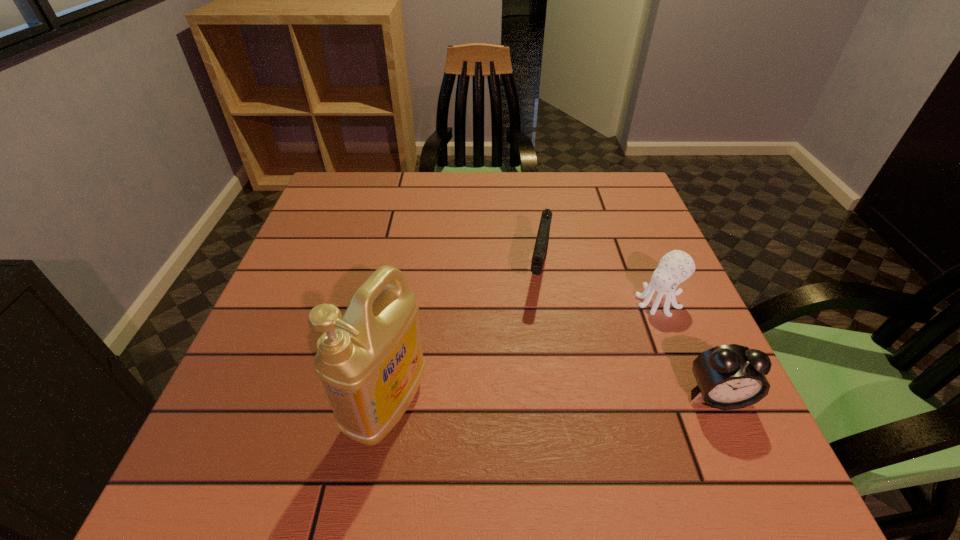
Locate an element on the screen. This screenshot has width=960, height=540. vacant area at the right edge of the desktop is located at coordinates (664, 317).

Where is `vacant space at the near left corner of the desktop`? Image resolution: width=960 pixels, height=540 pixels. vacant space at the near left corner of the desktop is located at coordinates (243, 426).

Identify the location of vacant space at the far right corner of the desktop. The width and height of the screenshot is (960, 540). (621, 201).

Image resolution: width=960 pixels, height=540 pixels. What are the coordinates of `vacant space at the near right corner of the desktop` in the screenshot? It's located at (674, 425).

This screenshot has width=960, height=540. In order to click on vacant space in between the leftmost object and the second object from left to right in this screenshot , I will do `click(463, 339)`.

This screenshot has width=960, height=540. In order to click on vacant area that lies between the pistol and the alarm clock in this screenshot , I will do `click(628, 334)`.

Find the location of a particular element. vacant space in between the detergent and the alarm clock is located at coordinates click(x=552, y=401).

The image size is (960, 540). Identify the location of vacant area that lies between the octopus and the alarm clock. (688, 349).

I want to click on unoccupied position between the detergent and the pistol, so click(x=463, y=339).

Identify the location of free space between the alarm clock and the detergent. This screenshot has height=540, width=960. (552, 401).